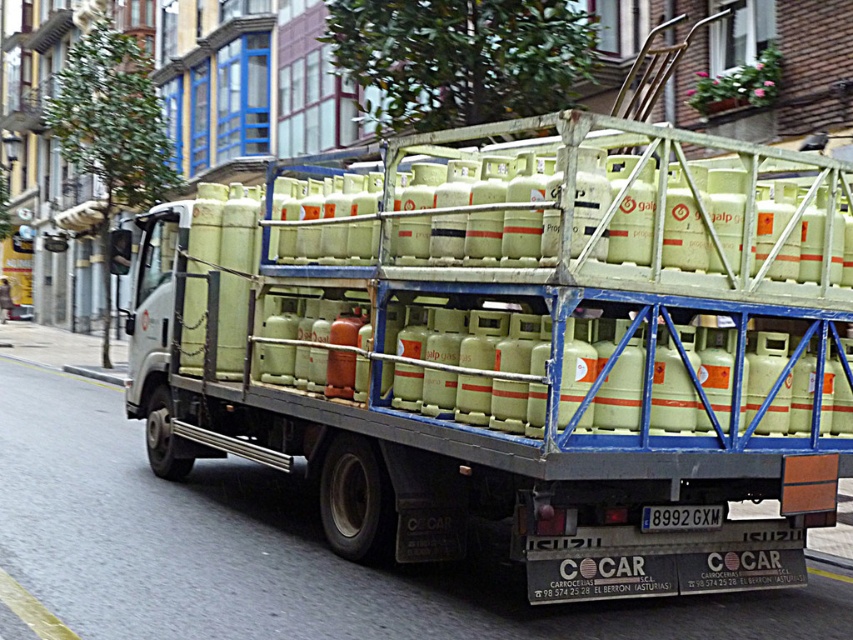
You are a delivery driver who needs to unload the matte green gas canisters at center from the truck. The unloading area has a loading dock that is 1.2 meters wide. Can you safely unload the canisters through this dock?

The matte green gas canisters at center are located at point (509, 356) on the truck bed. Since the loading dock is 1.2 meters wide, and the canisters are positioned centrally, they should fit within the dock width as long as their diameter is less than 1.2 meters. However, without specific dimensions of the canisters, it is impossible to confirm if they will fit. Please check the canister diameter before unloading.

You are a delivery driver who needs to confirm the license plate number of the truck. You see the matte green gas canisters at center and the white plastic license plate at center. Which object is positioned to the right side of the truck?

The white plastic license plate at center is positioned to the right side of the truck because the matte green gas canisters at center is to the left of it.

In the scene shown: You are a delivery driver who needs to confirm the dimensions of the items on your truck. You see the matte green gas canisters at center and the white plastic license plate at center. Which object is bigger in size?

The matte green gas canisters at center has a larger size compared to the white plastic license plate at center, so the matte green gas canisters at center is bigger.